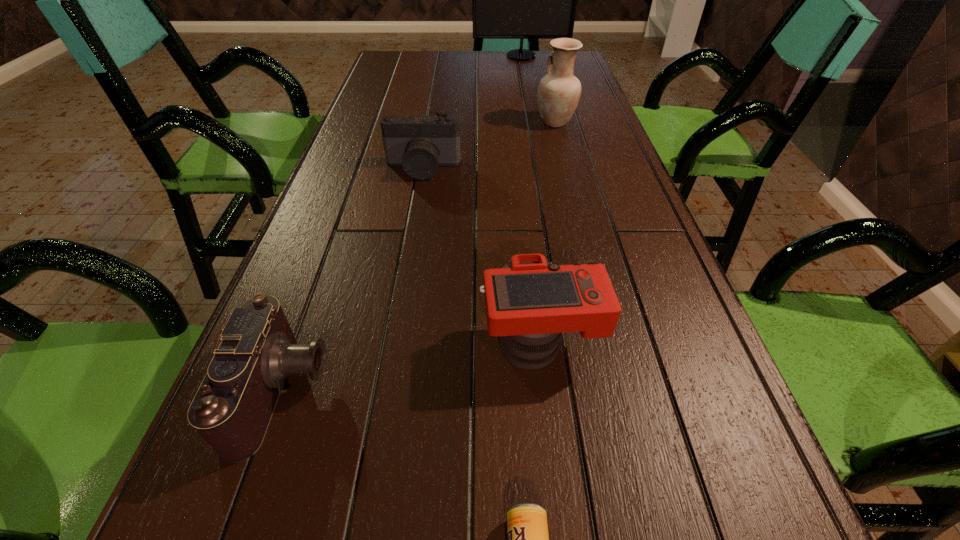
The image size is (960, 540). I want to click on the tallest object, so click(521, 0).

Identify the location of the farthest object. (521, 0).

Find the location of a particular element. This screenshot has height=540, width=960. the fifth nearest object is located at coordinates (559, 91).

Where is `pottery`? pottery is located at coordinates (559, 91).

In order to click on the rightmost camera in this screenshot , I will do `click(530, 302)`.

Locate an element on the screen. This screenshot has height=540, width=960. the farthest camera is located at coordinates (419, 144).

I want to click on free spot located 0.180m on the front-facing side of the computer monitor, so click(526, 80).

Find the location of a particular element. The height and width of the screenshot is (540, 960). vacant area located on the left of the pottery is located at coordinates (418, 122).

The image size is (960, 540). What are the coordinates of `free location located on the right of the rightmost camera` in the screenshot? It's located at (694, 341).

Where is `blank space located 0.300m at the lens of the fourth nearest object`? blank space located 0.300m at the lens of the fourth nearest object is located at coordinates (407, 264).